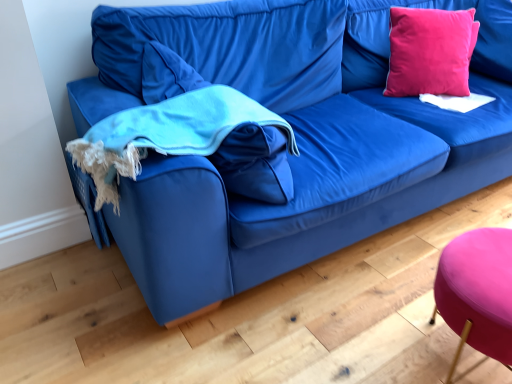
Locate an element on the screen. turquoise fleece blanket at left is located at coordinates (166, 134).

You are a GUI agent. You are given a task and a screenshot of the screen. Output one action in this format:
    pyautogui.click(x=<x>, y=<y>)
    Task: Click on the purple fabric stool at lower right
    This screenshot has width=512, height=384.
    Given the screenshot: What is the action you would take?
    pyautogui.click(x=477, y=292)

Does point (423, 51) appear closer or farther from the camera than point (154, 111)?

Point (423, 51) is farther from the camera than point (154, 111).

Can you tell me how much pink velvet pillow at upper right and turquoise fleece blanket at left differ in facing direction?

120 degrees separate the facing orientations of pink velvet pillow at upper right and turquoise fleece blanket at left.

Are pink velvet pillow at upper right and turquoise fleece blanket at left far apart?

Yes, pink velvet pillow at upper right and turquoise fleece blanket at left are located far from each other.

Who is shorter, pink velvet pillow at upper right or turquoise fleece blanket at left?

turquoise fleece blanket at left is shorter.

Are turquoise fleece blanket at left and pink velvet pillow at upper right far apart?

Absolutely, turquoise fleece blanket at left is distant from pink velvet pillow at upper right.

From the image's perspective, is turquoise fleece blanket at left located above or below pink velvet pillow at upper right?

turquoise fleece blanket at left is below pink velvet pillow at upper right.

Consider the image. Between turquoise fleece blanket at left and pink velvet pillow at upper right, which one has larger size?

turquoise fleece blanket at left is bigger.

Could you tell me if turquoise fleece blanket at left is turned towards pink velvet pillow at upper right?

Yes, turquoise fleece blanket at left is aimed at pink velvet pillow at upper right.

Which object is further away from the camera, turquoise fleece blanket at left or purple fabric stool at lower right?

→ turquoise fleece blanket at left is more distant.

Is turquoise fleece blanket at left wider than purple fabric stool at lower right?

Yes, turquoise fleece blanket at left is wider than purple fabric stool at lower right.

Considering the positions of objects turquoise fleece blanket at left and purple fabric stool at lower right in the image provided, who is more to the left, turquoise fleece blanket at left or purple fabric stool at lower right?

From the viewer's perspective, turquoise fleece blanket at left appears more on the left side.

Does purple fabric stool at lower right lie in front of pink velvet pillow at upper right?

Yes, purple fabric stool at lower right is in front of pink velvet pillow at upper right.

Measure the distance from purple fabric stool at lower right to pink velvet pillow at upper right.

3.66 feet.

Is purple fabric stool at lower right at the left side of pink velvet pillow at upper right?

Correct, you'll find purple fabric stool at lower right to the left of pink velvet pillow at upper right.

Does point (454, 242) appear closer or farther from the camera than point (390, 70)?

Clearly, point (454, 242) is closer to the camera than point (390, 70).

From a real-world perspective, is purple fabric stool at lower right physically located above or below turquoise fleece blanket at left?

In terms of real-world spatial position, purple fabric stool at lower right is below turquoise fleece blanket at left.

In terms of height, does purple fabric stool at lower right look taller or shorter compared to turquoise fleece blanket at left?

Considering their sizes, purple fabric stool at lower right has more height than turquoise fleece blanket at left.

Is purple fabric stool at lower right outside of turquoise fleece blanket at left?

Yes, purple fabric stool at lower right is not within turquoise fleece blanket at left.

Is point (483, 322) closer or farther from the camera than point (266, 116)?

Point (483, 322) appears to be closer to the viewer than point (266, 116).

Does pink velvet pillow at upper right have a greater width compared to purple fabric stool at lower right?

No.

Does point (401, 82) appear closer or farther from the camera than point (489, 282)?

Point (401, 82) appears to be farther away from the viewer than point (489, 282).

Identify the location of throw pillow above the purple fabric stool at lower right (from the image's perspective). (430, 51).

Is pink velvet pillow at upper right turned away from purple fabric stool at lower right?

pink velvet pillow at upper right does not have its back to purple fabric stool at lower right.

Find the location of a particular element. The height and width of the screenshot is (384, 512). cloth in front of the pink velvet pillow at upper right is located at coordinates (166, 134).

In the image, there is a turquoise fleece blanket at left. Where is `throw pillow above it (from the image's perspective)`? The height and width of the screenshot is (384, 512). throw pillow above it (from the image's perspective) is located at coordinates (430, 51).

When comparing their distances from pink velvet pillow at upper right, does purple fabric stool at lower right or turquoise fleece blanket at left seem closer?

turquoise fleece blanket at left lies closer to pink velvet pillow at upper right than the other object.

Which object lies nearer to the anchor point pink velvet pillow at upper right, turquoise fleece blanket at left or purple fabric stool at lower right?

turquoise fleece blanket at left is positioned closer to the anchor pink velvet pillow at upper right.

When comparing their distances from purple fabric stool at lower right, does pink velvet pillow at upper right or turquoise fleece blanket at left seem further?

pink velvet pillow at upper right lies further to purple fabric stool at lower right than the other object.

From the image, which object appears to be farther from turquoise fleece blanket at left, purple fabric stool at lower right or pink velvet pillow at upper right?

pink velvet pillow at upper right is further to turquoise fleece blanket at left.

When comparing their distances from turquoise fleece blanket at left, does pink velvet pillow at upper right or purple fabric stool at lower right seem further?

Among the two, pink velvet pillow at upper right is located further to turquoise fleece blanket at left.

From the image, which object appears to be nearer to purple fabric stool at lower right, turquoise fleece blanket at left or pink velvet pillow at upper right?

Based on the image, turquoise fleece blanket at left appears to be nearer to purple fabric stool at lower right.

At what (x,y) coordinates should I click in order to perform the action: click on stool between turquoise fleece blanket at left and pink velvet pillow at upper right. Please return your answer as a coordinate pair (x, y). Looking at the image, I should click on (477, 292).